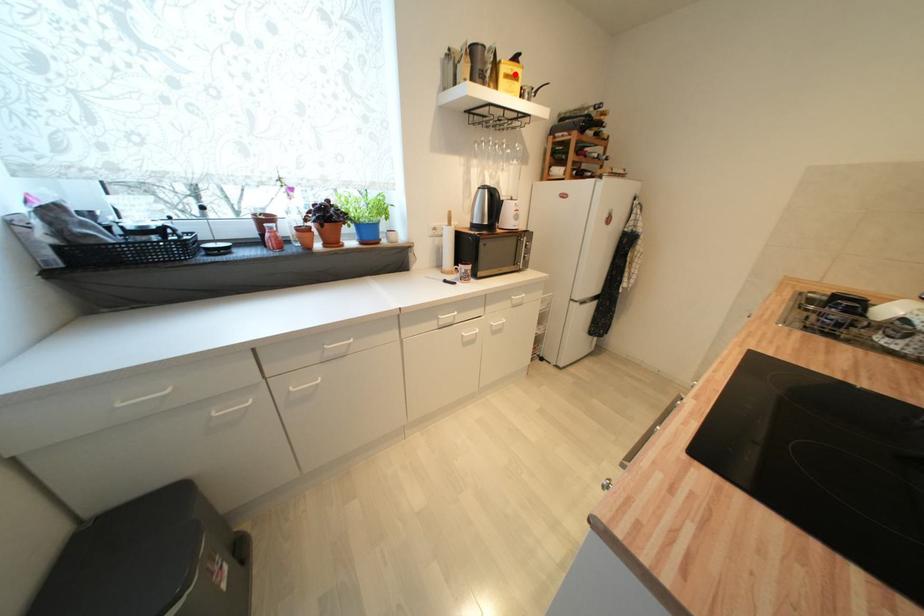
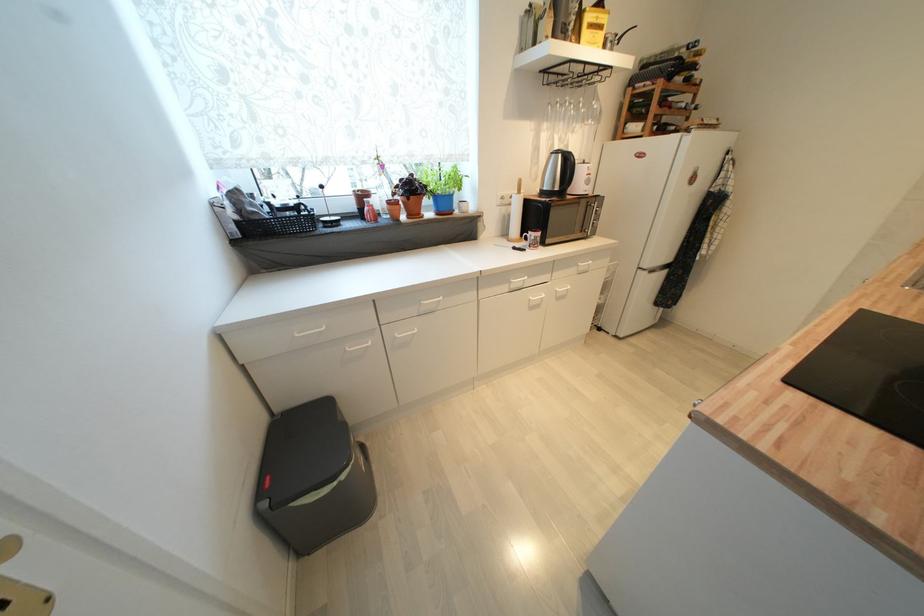
Find the pixel in the second image that matches the highlighted location in the first image.

(600, 23)